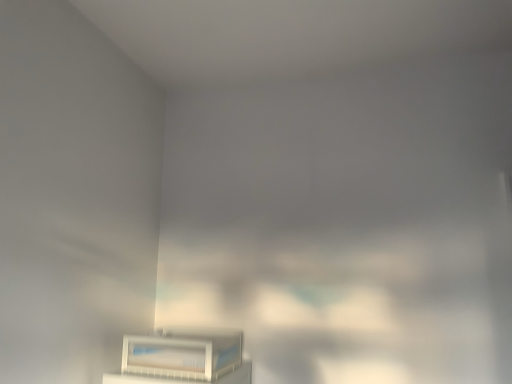
Question: Should I look upward or downward to see white plastic air conditioner at lower center?

Choices:
 (A) up
 (B) down

Answer: (B)